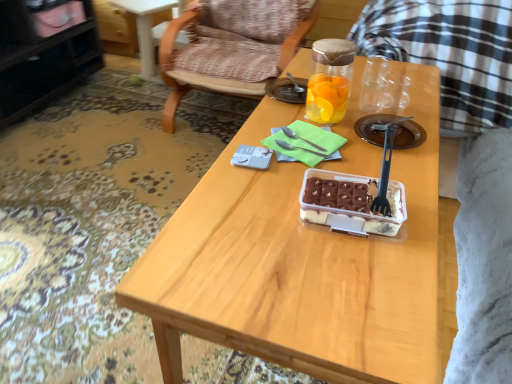
Identify the location of free spot above translucent plastic container at center (from a real-world perspective). (357, 191).